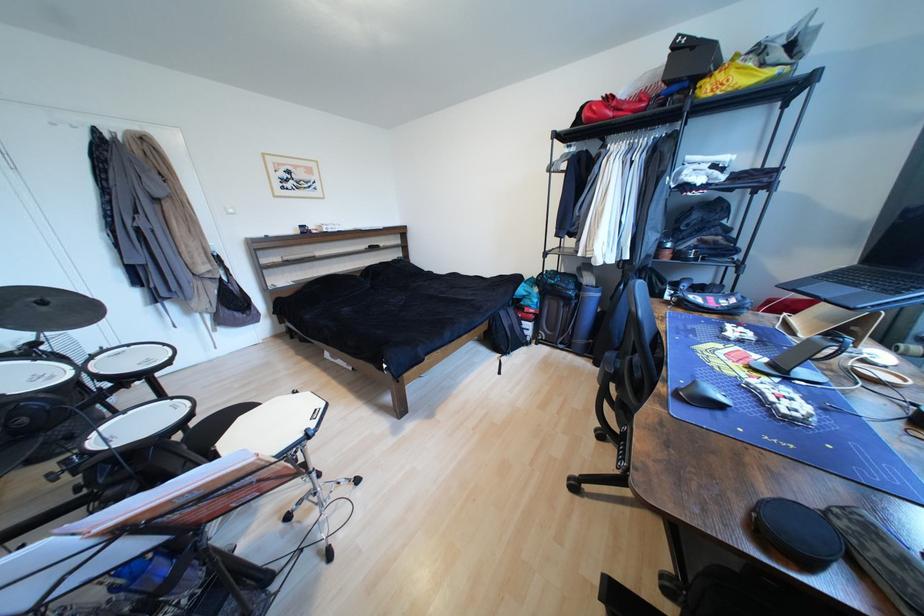
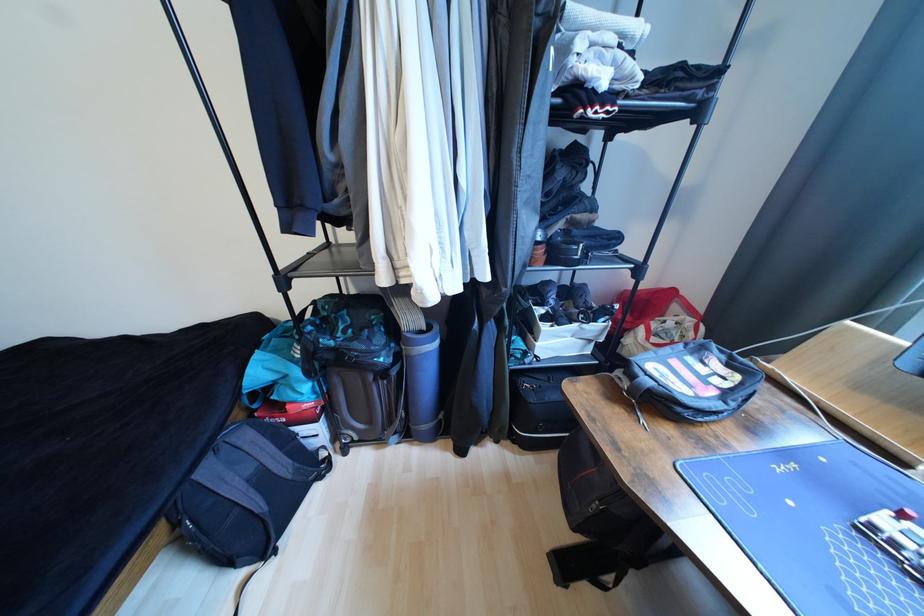
The point at (508, 315) is marked in the first image. Where is the corresponding point in the second image?

(215, 472)